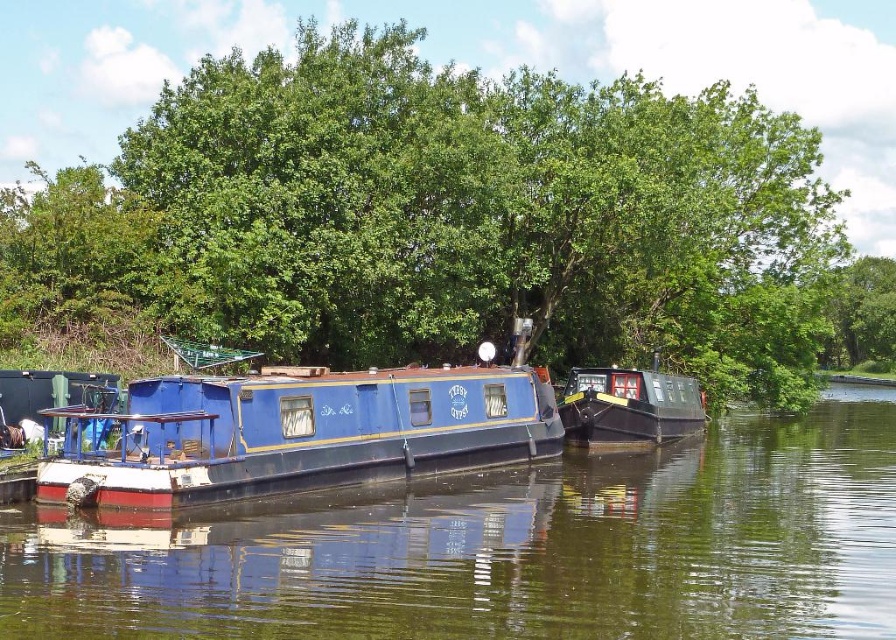
You are an observer standing on the riverside path. You notice the green leafy tree at upper center and the blue polished wood boat at center. Which object appears bigger in the scene?

The green leafy tree at upper center appears bigger than the blue polished wood boat at center in the scene.

You are standing on the riverside and see two points marked on the image. The first point is at coordinates point (435, 426) and the second point is at point (639, 404). Which point is closer to you?

Point (435, 426) is in front of point (639, 404), so it is closer to you.

In the scene shown: You are standing at the riverside and want to take a photo of the green leafy tree at upper center. The camera you are using has a maximum focus range of 25 meters. Will the tree be in focus?

The green leafy tree at upper center is 24.68 meters from camera, so yes, the tree will be in focus since it is within the camera maximum focus range of 25 meters.